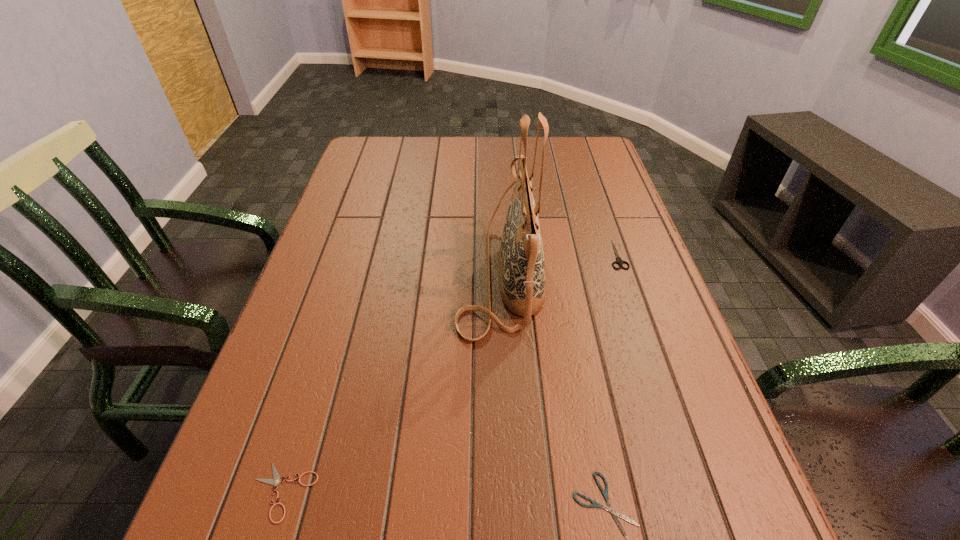
This screenshot has width=960, height=540. In order to click on object located in the right edge section of the desktop in this screenshot , I will do `click(619, 261)`.

At what (x,y) coordinates should I click in order to perform the action: click on free space at the far edge. Please return your answer as a coordinate pair (x, y). The width and height of the screenshot is (960, 540). Looking at the image, I should click on (553, 170).

You are a GUI agent. You are given a task and a screenshot of the screen. Output one action in this format:
    pyautogui.click(x=<x>, y=<y>)
    Task: Click on the free space at the left edge of the desktop
    Image resolution: width=960 pixels, height=540 pixels.
    Given the screenshot: What is the action you would take?
    pyautogui.click(x=342, y=307)

You are a GUI agent. You are given a task and a screenshot of the screen. Output one action in this format:
    pyautogui.click(x=<x>, y=<y>)
    Task: Click on the free space at the right edge
    The height and width of the screenshot is (540, 960).
    Given the screenshot: What is the action you would take?
    pyautogui.click(x=639, y=259)

Find the location of a particular element. This screenshot has height=540, width=960. blank space at the far left corner is located at coordinates (362, 172).

The image size is (960, 540). In the image, there is a desktop. Identify the location of vacant space at the far right corner. (606, 157).

I want to click on free point between the tallest object and the rightmost shears, so coord(559,265).

The height and width of the screenshot is (540, 960). In order to click on vacant space in between the leftmost object and the handbag in this screenshot , I will do `click(392, 383)`.

Find the location of a particular element. This screenshot has width=960, height=540. vacant space that is in between the leftmost object and the handbag is located at coordinates [392, 383].

Locate an element on the screen. This screenshot has width=960, height=540. unoccupied area between the leftmost object and the handbag is located at coordinates (392, 383).